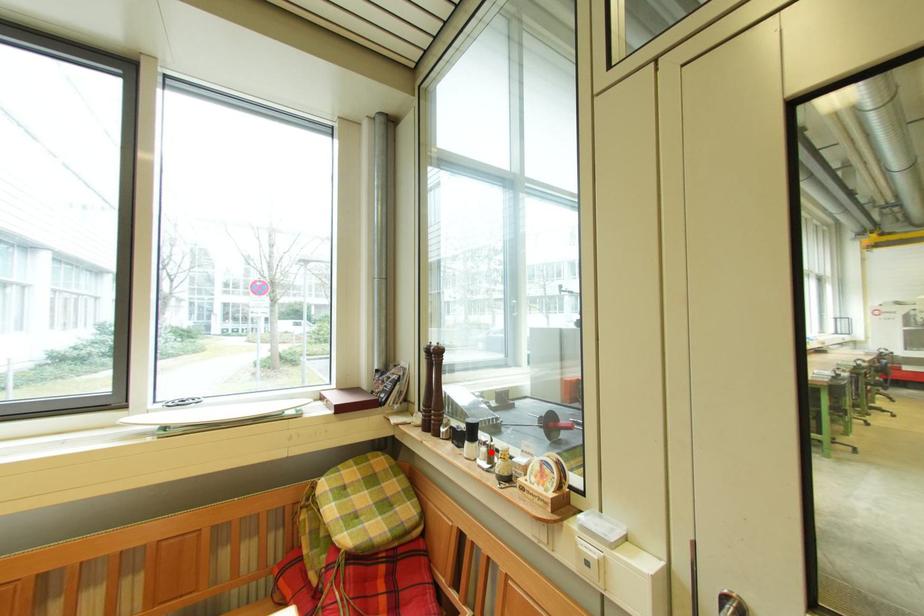
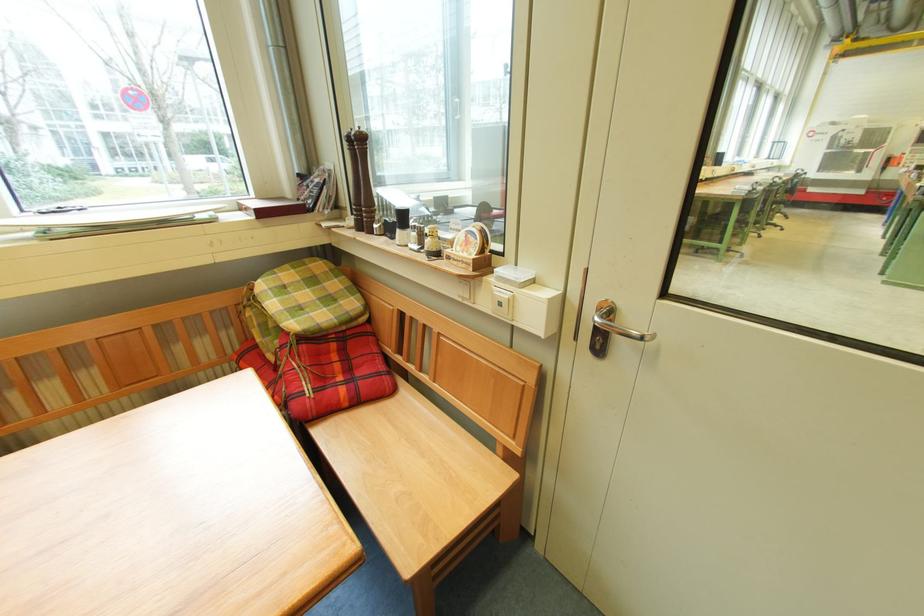
Locate, in the second image, the point that corresponds to the highlighted location in the first image.

(421, 236)